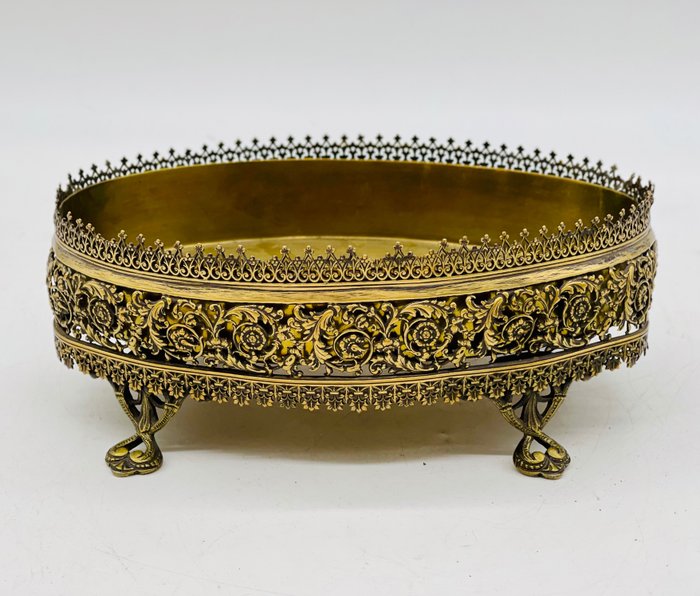
In order to click on center of shadow under bowl in this screenshot , I will do `click(349, 434)`.